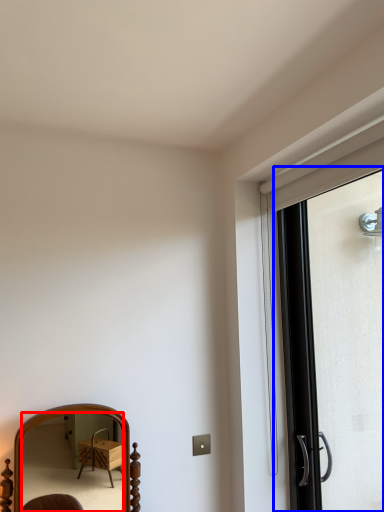
Question: Which of the following is the farthest to the observer, mirror (highlighted by a red box) or screen door (highlighted by a blue box)?

Choices:
 (A) mirror
 (B) screen door

Answer: (A)